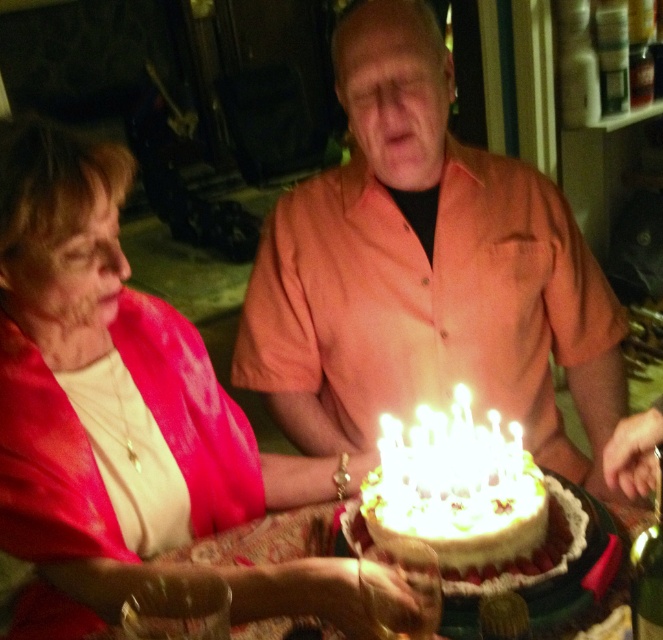
The height and width of the screenshot is (640, 663). Describe the element at coordinates (109, 396) in the screenshot. I see `matte red blouse at upper left` at that location.

Which is in front, point (103, 316) or point (499, 474)?

Point (103, 316)

What do you see at coordinates (109, 396) in the screenshot? The height and width of the screenshot is (640, 663). I see `matte red blouse at upper left` at bounding box center [109, 396].

The image size is (663, 640). What are the coordinates of `matte red blouse at upper left` in the screenshot? It's located at click(x=109, y=396).

Does orange matte shirt at center appear under white wax candles at center?

No, orange matte shirt at center is not below white wax candles at center.

What do you see at coordinates (426, 272) in the screenshot? I see `orange matte shirt at center` at bounding box center [426, 272].

Describe the element at coordinates (426, 272) in the screenshot. I see `orange matte shirt at center` at that location.

Locate an element on the screen. orange matte shirt at center is located at coordinates (426, 272).

Is orange matte shirt at center further to the viewer compared to white frosted cake at center?

Yes, orange matte shirt at center is further from the viewer.

Who is more distant from viewer, (522, 400) or (514, 504)?

Point (522, 400)

Locate an element on the screen. orange matte shirt at center is located at coordinates (426, 272).